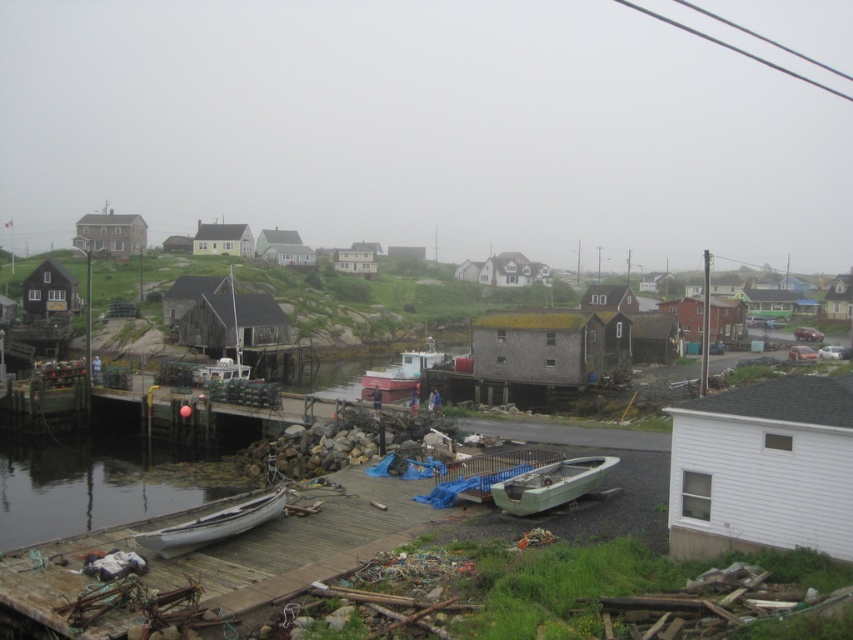
From the picture: You are standing on the wooden dock and want to board a boat. You have two options in front of you. The white wooden canoe at lower left and the red matte boat at center. Which one is shorter in height?

The white wooden canoe at lower left has a lesser height compared to the red matte boat at center, so it is shorter in height.

You are standing at the center of the image and want to walk to the wooden dock at lower left. In which direction should you move relative to your current position?

Since the wooden dock at lower left is located at point (x=227, y=552), you should move towards the lower left direction from your current position at the center to reach it.